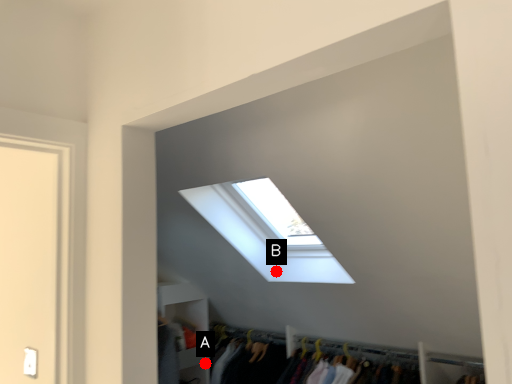
Question: Two points are circled on the image, labeled by A and B beside each circle. Which point is farther from the camera taking this photo?

Choices:
 (A) A is further
 (B) B is further

Answer: (A)